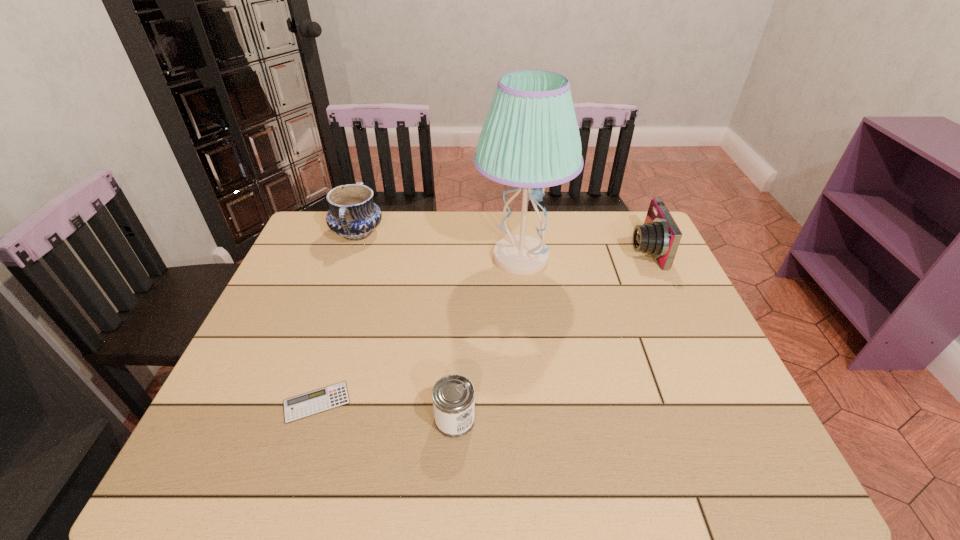
Identify the location of free spot that satisfies the following two spatial constraints: 1. on the back side of the tallest object; 2. on the right side of the calculator. (363, 258).

Where is `free location that satisfies the following two spatial constraints: 1. on the back side of the second shortest object; 2. on the left side of the tallest object`? This screenshot has height=540, width=960. free location that satisfies the following two spatial constraints: 1. on the back side of the second shortest object; 2. on the left side of the tallest object is located at coordinates [463, 258].